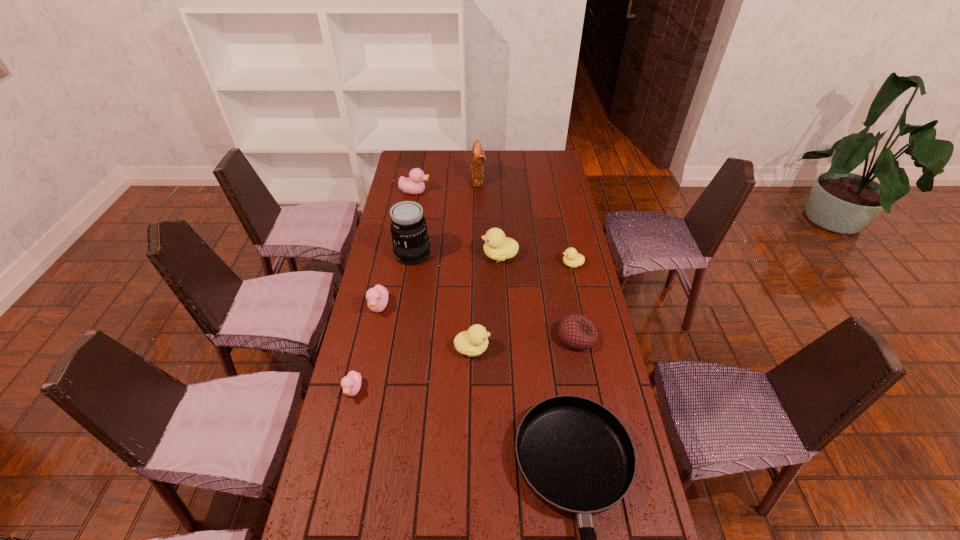
Identify the location of vacant space located at the beak of the nearest yellow duckling. (577, 348).

The image size is (960, 540). What are the coordinates of `vacant space located 0.050m on the front-facing side of the sixth farthest object` in the screenshot? It's located at (374, 330).

The width and height of the screenshot is (960, 540). Find the location of `free spot located on the left of the beanbag`. free spot located on the left of the beanbag is located at coordinates (460, 338).

Locate an element on the screen. vacant space located at the beak of the smallest yellow duckling is located at coordinates (506, 264).

Locate an element on the screen. Image resolution: width=960 pixels, height=540 pixels. free point located 0.090m at the beak of the smallest yellow duckling is located at coordinates (539, 264).

In order to click on vacant space positioned at the beak of the smallest yellow duckling in this screenshot , I will do `click(511, 264)`.

Where is `free region located on the front-facing side of the ninth farthest object`? free region located on the front-facing side of the ninth farthest object is located at coordinates (340, 449).

The width and height of the screenshot is (960, 540). Find the location of `object located at the far edge`. object located at the far edge is located at coordinates (477, 157).

Image resolution: width=960 pixels, height=540 pixels. What are the coordinates of `telephoto lens that is at the left edge` in the screenshot? It's located at (408, 226).

This screenshot has height=540, width=960. I want to click on beanbag located in the right edge section of the desktop, so click(577, 332).